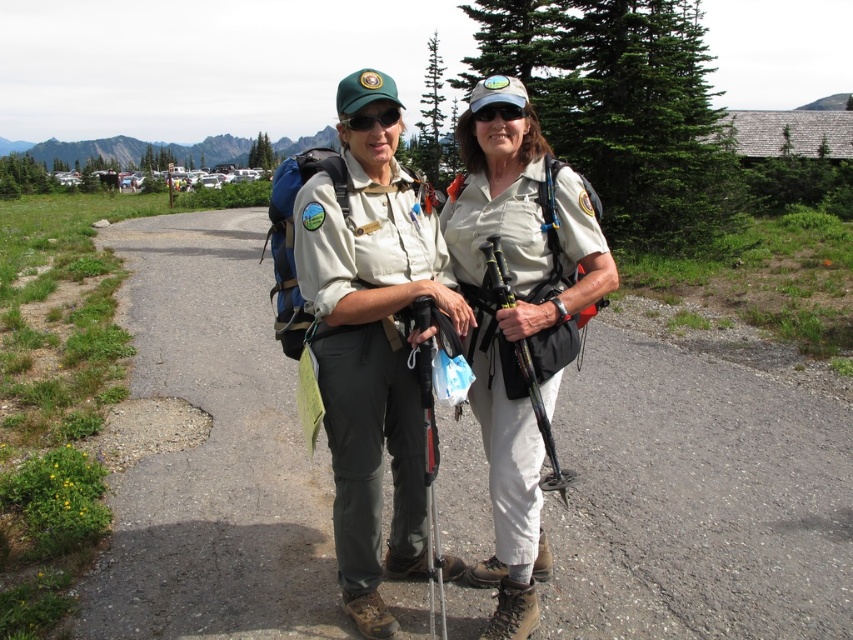
You are a hiker who wants to place both the black rubber ski pole at center and the matte black goggles at center into a backpack compartment. The compartment has a maximum capacity of 2 liters. Knowing that the ski pole takes up more space, will both items fit?

The black rubber ski pole at center has a larger size compared to matte black goggles at center. Since the ski pole takes up more space and the compartment only holds 2 liters, it is uncertain if both will fit without exceeding the capacity.

You are a hiker who wants to place both the black rubber ski pole at center and the matte black goggles at center into a storage compartment. If the compartment is 30 inches wide, will both items fit side by side?

The black rubber ski pole at center and matte black goggles at center are 30.06 inches apart, so they cannot fit into a 30 inch wide compartment since the total width required is slightly more than the available space.